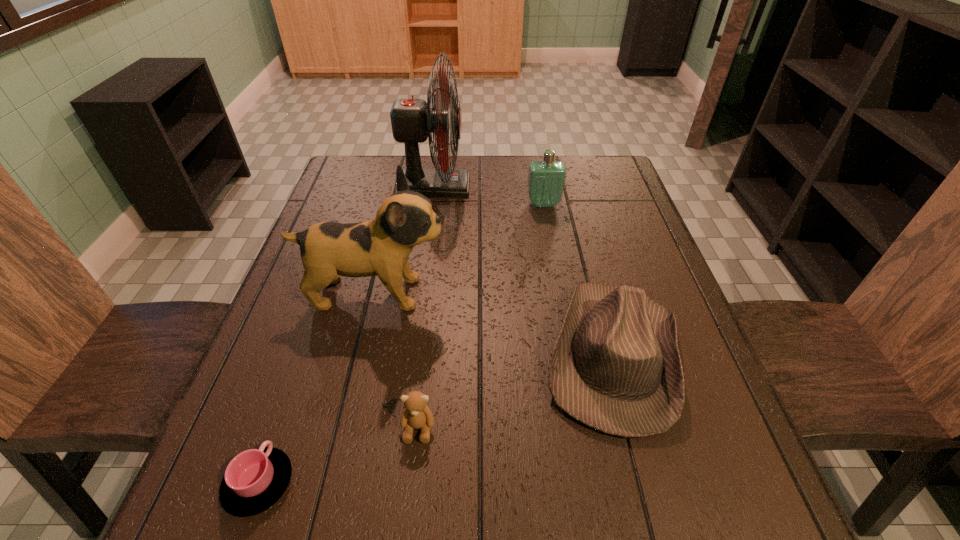
At what (x,y) coordinates should I click in order to perform the action: click on the tallest object. Please return your answer as a coordinate pair (x, y). Looking at the image, I should click on (413, 121).

Identify the location of the second tallest object. (381, 246).

At what (x,y) coordinates should I click in order to perform the action: click on the fourth shortest object. Please return your answer as a coordinate pair (x, y). This screenshot has height=540, width=960. Looking at the image, I should click on (546, 179).

Identify the location of the fourth tallest object. (616, 367).

Where is `the fifth tallest object`? The height and width of the screenshot is (540, 960). the fifth tallest object is located at coordinates (416, 415).

You are a GUI agent. You are given a task and a screenshot of the screen. Output one action in this format:
    pyautogui.click(x=<x>, y=<y>)
    Task: Click on the shortest object
    The width and height of the screenshot is (960, 540).
    Given the screenshot: What is the action you would take?
    pyautogui.click(x=254, y=480)

I want to click on the nearest object, so click(x=254, y=480).

The width and height of the screenshot is (960, 540). Find the location of `free spot located 0.390m on the front-facing side of the tallest object`. free spot located 0.390m on the front-facing side of the tallest object is located at coordinates (599, 187).

Locate an element on the screen. The height and width of the screenshot is (540, 960). vacant space located 0.360m at the face of the puppy is located at coordinates (604, 293).

The height and width of the screenshot is (540, 960). What are the coordinates of `vacant space located on the front label of the perfume` in the screenshot? It's located at (549, 234).